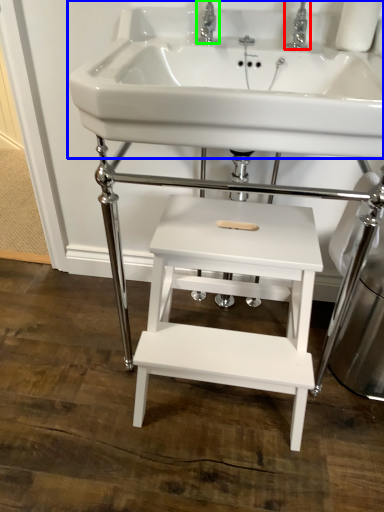
Question: Based on their relative distances, which object is farther from tap (highlighted by a red box)? Choose from sink (highlighted by a blue box) and tap (highlighted by a green box).

Choices:
 (A) sink
 (B) tap

Answer: (A)